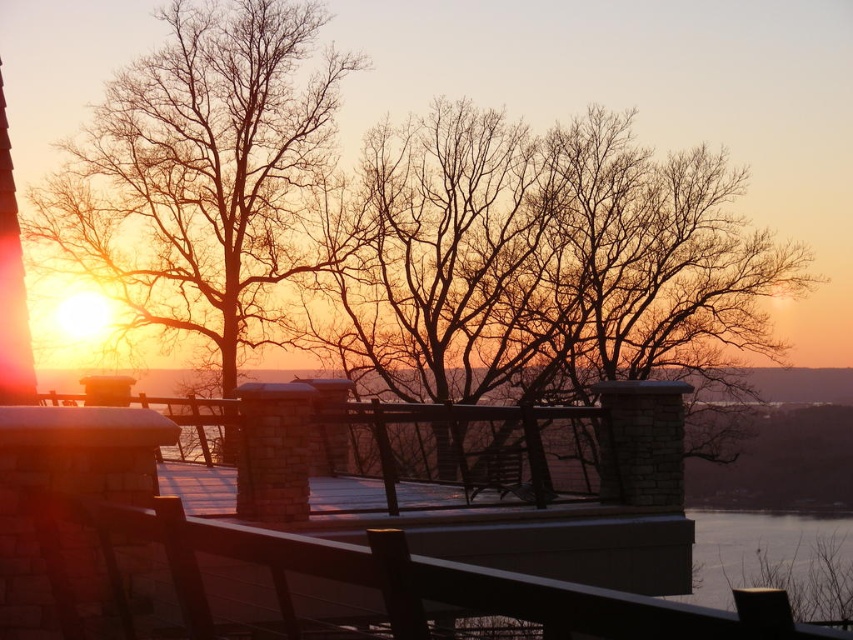
You are standing on the brown wood balcony at center and want to take a photo of the bare branches at left. To frame the shot properly, should you move to your left or right side of the balcony?

Since the brown wood balcony at center is to the right of the bare branches at left, you should move to your left side of the balcony to better frame the bare branches at left in the photo.